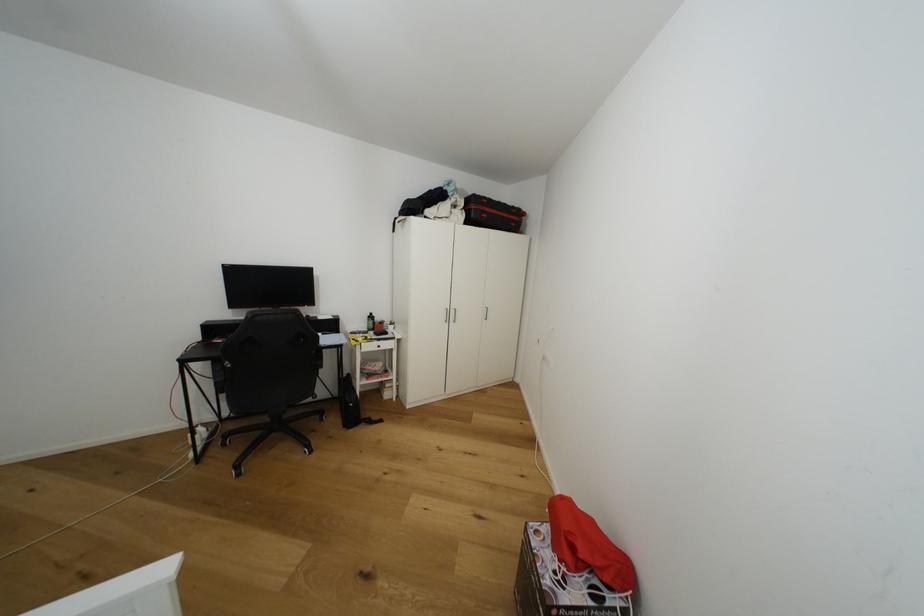
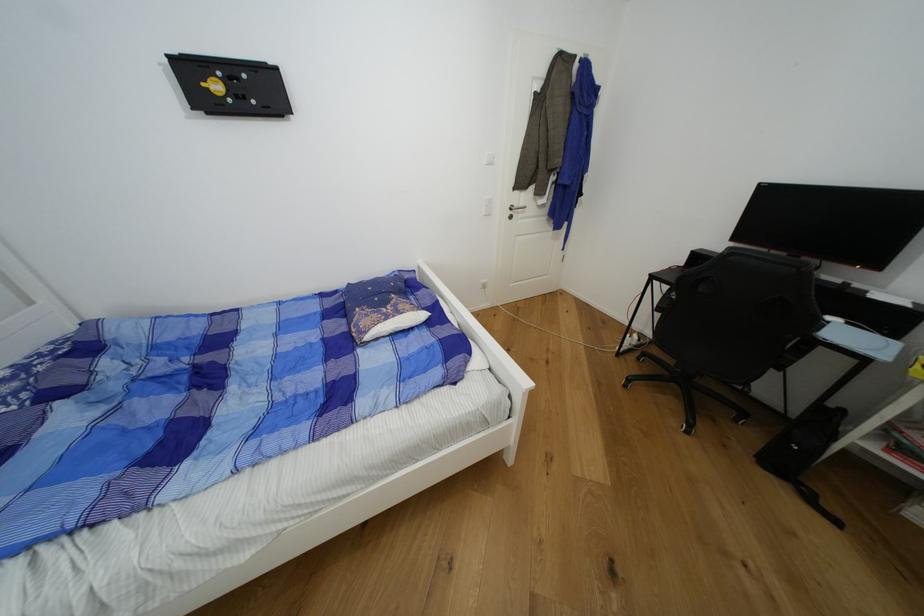
The point at [351,383] is marked in the first image. Where is the corresponding point in the second image?

(833, 418)